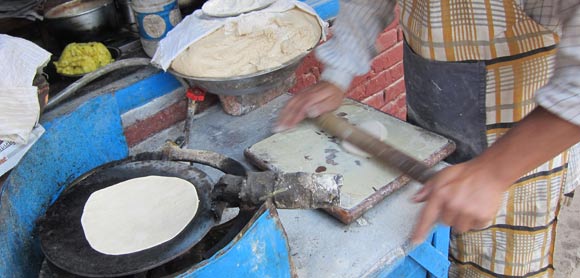
Identify the location of blue table. This screenshot has height=278, width=580. [x=258, y=260].